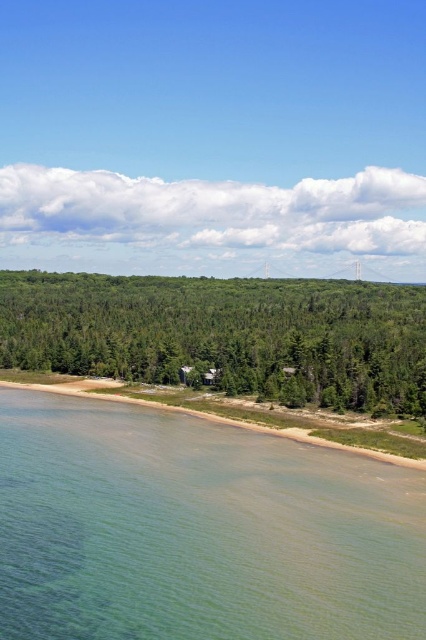
From the picture: You are standing on the beach and want to take a photo of the clear water at lower left and the green leafy trees at center. Which object will appear smaller in your photo?

The clear water at lower left will appear smaller in the photo because it is thinner than the green leafy trees at center.

You are standing on the beach and want to take a photo of the green leafy trees at center while avoiding the clear water at lower left. Which direction should you move to ensure the water isn

You should move to the right to avoid the clear water at lower left, as it is located below the green leafy trees at center and moving right would position you away from the water.